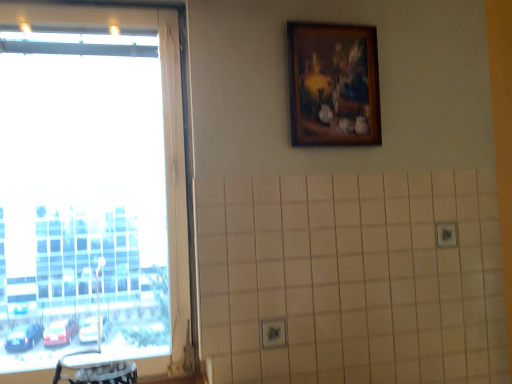
Question: Does wooden picture frame at upper center contain transparent glass window at left?

Choices:
 (A) no
 (B) yes

Answer: (A)

Question: From a real-world perspective, is wooden picture frame at upper center on top of transparent glass window at left?

Choices:
 (A) yes
 (B) no

Answer: (A)

Question: Is wooden picture frame at upper center positioned in front of transparent glass window at left?

Choices:
 (A) yes
 (B) no

Answer: (B)

Question: Is wooden picture frame at upper center bigger than transparent glass window at left?

Choices:
 (A) yes
 (B) no

Answer: (B)

Question: Is wooden picture frame at upper center completely or partially outside of transparent glass window at left?

Choices:
 (A) yes
 (B) no

Answer: (A)

Question: Does wooden picture frame at upper center have a lesser width compared to transparent glass window at left?

Choices:
 (A) yes
 (B) no

Answer: (A)

Question: Can you confirm if transparent glass window at left is thinner than wooden picture frame at upper center?

Choices:
 (A) yes
 (B) no

Answer: (B)

Question: Would you say transparent glass window at left contains wooden picture frame at upper center?

Choices:
 (A) no
 (B) yes

Answer: (A)

Question: Can you see transparent glass window at left touching wooden picture frame at upper center?

Choices:
 (A) no
 (B) yes

Answer: (A)

Question: Can you confirm if transparent glass window at left is wider than wooden picture frame at upper center?

Choices:
 (A) no
 (B) yes

Answer: (B)

Question: Considering the relative sizes of transparent glass window at left and wooden picture frame at upper center in the image provided, is transparent glass window at left bigger than wooden picture frame at upper center?

Choices:
 (A) yes
 (B) no

Answer: (A)

Question: From the image's perspective, is transparent glass window at left on top of wooden picture frame at upper center?

Choices:
 (A) no
 (B) yes

Answer: (A)

Question: Relative to wooden picture frame at upper center, is transparent glass window at left in front or behind?

Choices:
 (A) front
 (B) behind

Answer: (A)